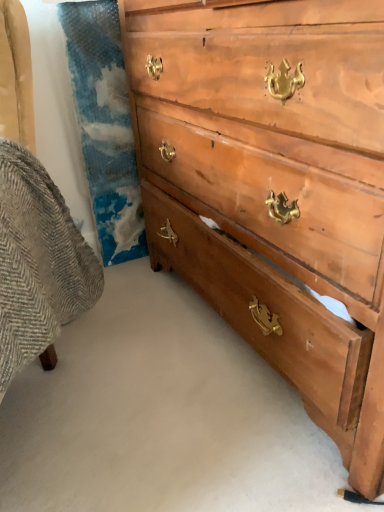
In order to click on free spot below textured gray fabric swivel chair at left (from a real-world perspective) in this screenshot , I will do `click(52, 432)`.